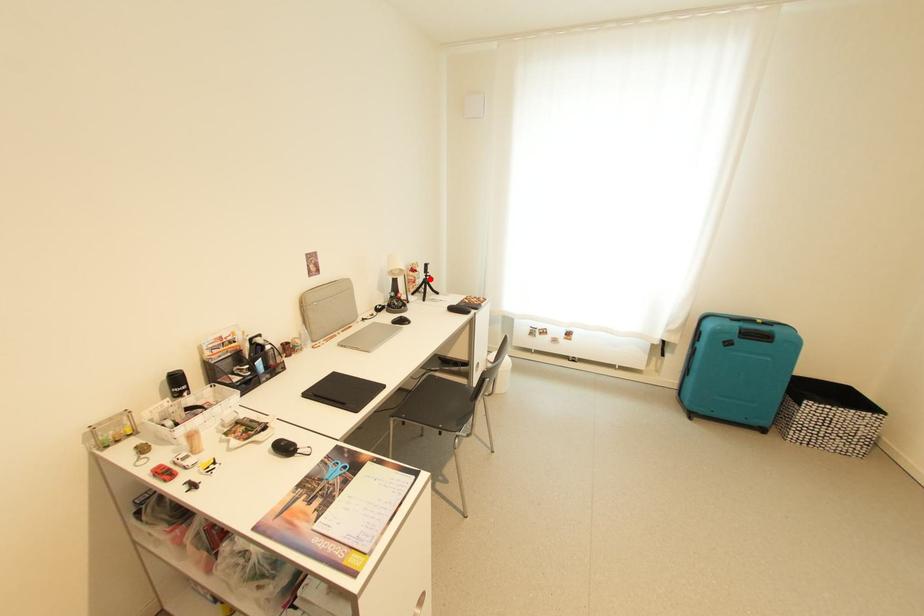
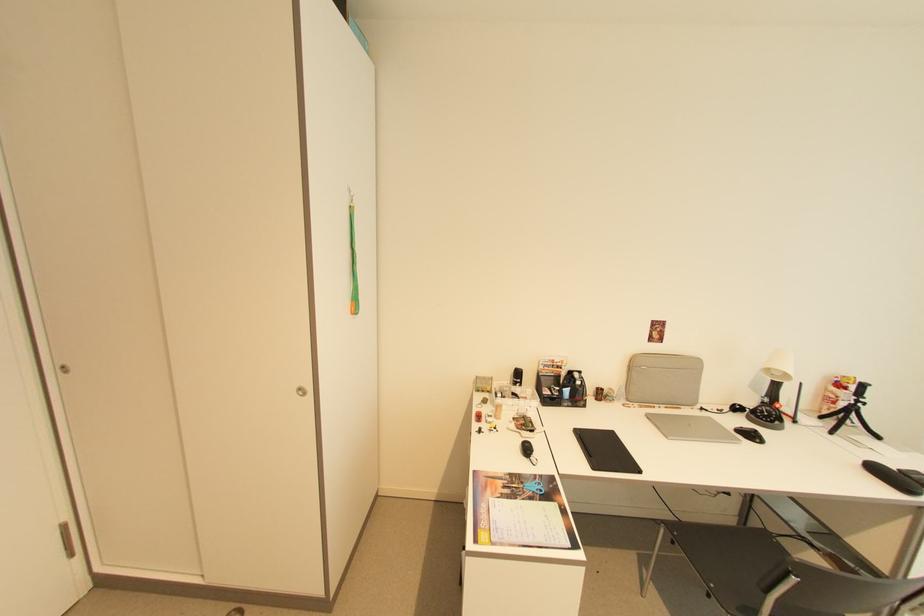
Question: I am providing you with two images of the same scene from different viewpoints. Given a red point in image1, look at the same physical point in image2. Is it:

Choices:
 (A) Closer to the viewpoint
 (B) Farther from the viewpoint

Answer: (A)